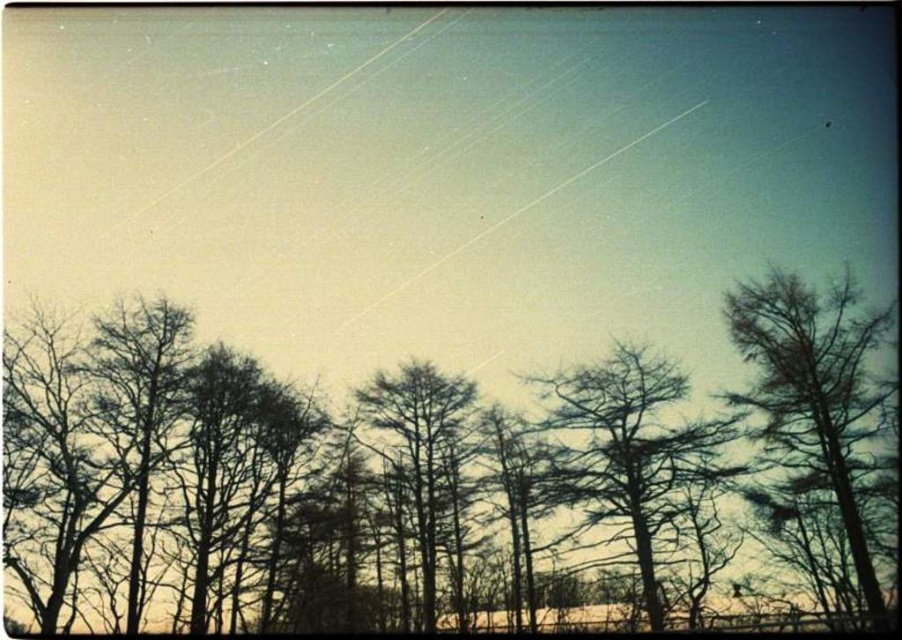
You are an artist sketching this scene and want to ensure the trees are proportionally accurate. Which tree should you draw first to maintain the correct size relationship between the brown matte trees at center and the green matte tree at center?

You should draw the brown matte trees at center first since they are bigger than the green matte tree at center, ensuring the size relationship is maintained.

Based on the photo, you are standing in a winter forest and see the brown matte trees at center and the green matte tree at center. Which tree is closer to you?

The brown matte trees at center are closer to the viewer than the green matte tree at center.